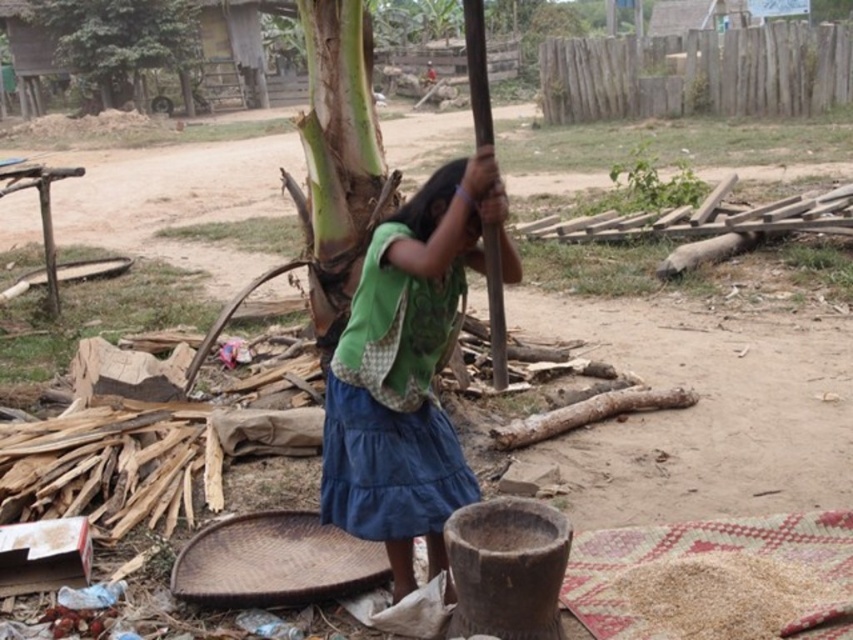
You are standing at point (471, 180) and want to walk to point (409, 438). Is the destination point behind you or in front of you?

The destination point (409, 438) is behind point (471, 180), so it is behind you.

You are a traveler who needs to pack your belongings. You see a green fabric bag at center and a dark green fabric at center. Which one has a larger width to hold more items?

The green fabric bag at center might be wider than dark green fabric at center, so it could potentially hold more items.

You are a traveler who needs to pack your belongings. You see a green fabric bag at center and a dark green fabric at center. Which one can hold more items based on their height?

The green fabric bag at center is much taller than the dark green fabric at center, so it can hold more items based on their height.